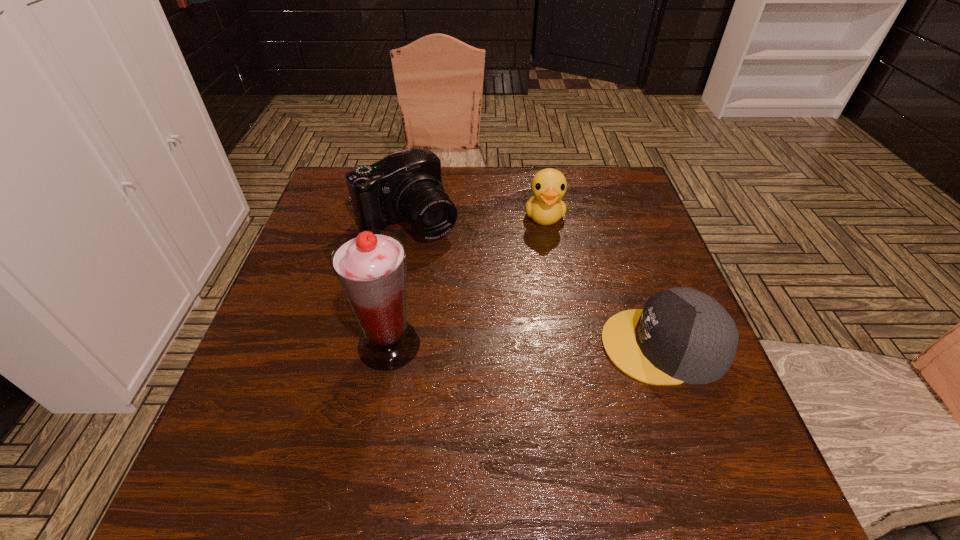
The image size is (960, 540). In order to click on vacant point located on the lens of the camera in this screenshot , I will do `click(474, 301)`.

Image resolution: width=960 pixels, height=540 pixels. In order to click on vacant point located 0.160m on the lens of the camera in this screenshot , I will do `click(461, 284)`.

Where is `blank space located 0.100m on the face of the duck`? This screenshot has width=960, height=540. blank space located 0.100m on the face of the duck is located at coordinates click(x=549, y=260).

This screenshot has width=960, height=540. What are the coordinates of `vacant space located 0.060m on the face of the duck` in the screenshot? It's located at (548, 249).

Where is `free space located 0.240m on the face of the duck`? This screenshot has height=540, width=960. free space located 0.240m on the face of the duck is located at coordinates (554, 302).

Find the location of a particular element. camera that is at the far edge is located at coordinates (406, 185).

At what (x,y) coordinates should I click in order to perform the action: click on duck positioned at the far edge. Please return your answer as a coordinate pair (x, y). Looking at the image, I should click on (548, 186).

At what (x,y) coordinates should I click in order to perform the action: click on object located in the left edge section of the desktop. Please return your answer as a coordinate pair (x, y). The height and width of the screenshot is (540, 960). Looking at the image, I should click on (406, 185).

Locate an element on the screen. object that is at the right edge is located at coordinates (682, 335).

The image size is (960, 540). In order to click on object present at the far left corner in this screenshot , I will do `click(406, 185)`.